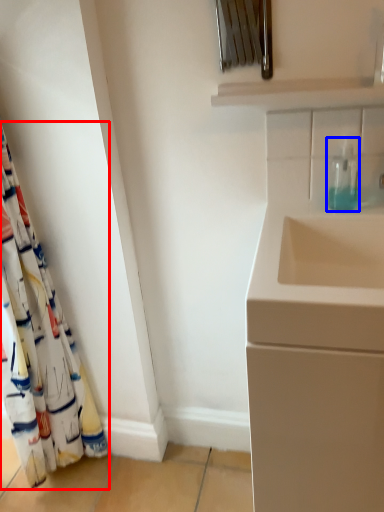
Question: Which point is closer to the camera, curtain (highlighted by a red box) or soap dispenser (highlighted by a blue box)?

Choices:
 (A) curtain
 (B) soap dispenser

Answer: (A)